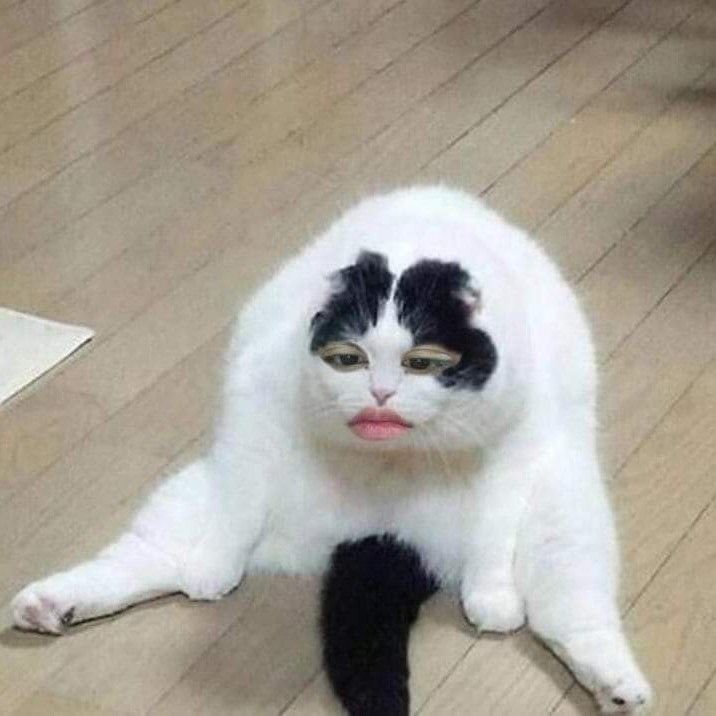
Find the location of a particular element. Image resolution: width=716 pixels, height=716 pixels. hard woof floor is located at coordinates (618, 117), (170, 202).